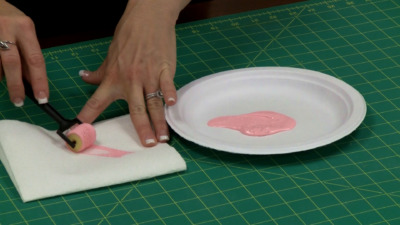
Find the location of `paper towel`. paper towel is located at coordinates (54, 166).